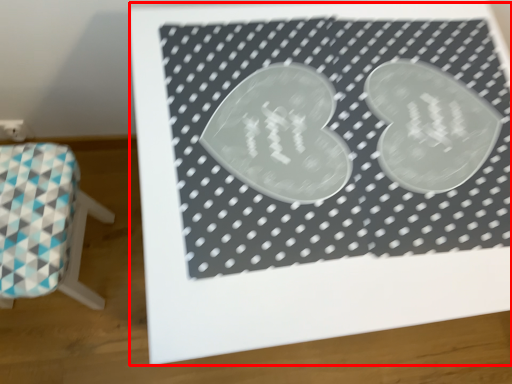
Question: Considering the relative positions of bulletin board (annotated by the red box) and furniture in the image provided, where is bulletin board (annotated by the red box) located with respect to the staircase?

Choices:
 (A) right
 (B) left

Answer: (A)